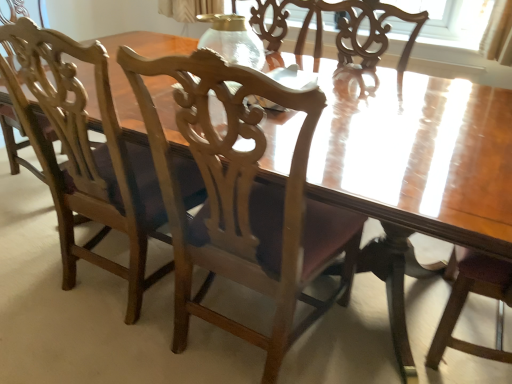
Question: Do you think wooden chair at center, the 2th chair from the left, is within wooden chair at left, placed as the 2th chair when sorted from right to left, or outside of it?

Choices:
 (A) outside
 (B) inside

Answer: (A)

Question: In the image, is wooden chair at center, which ranks as the first chair in right-to-left order, on the left side or the right side of wooden chair at left, placed as the 2th chair when sorted from right to left?

Choices:
 (A) left
 (B) right

Answer: (B)

Question: Estimate the real-world distances between objects in this image. Which object is farther from the wooden chair at left, which is the 1th chair in left-to-right order?

Choices:
 (A) transparent glass vase at center
 (B) wooden chair at center, the 2th chair from the left

Answer: (A)

Question: Based on their relative distances, which object is nearer to the transparent glass vase at center?

Choices:
 (A) wooden chair at left, which is the 1th chair in left-to-right order
 (B) wooden chair at center, which ranks as the first chair in right-to-left order

Answer: (B)